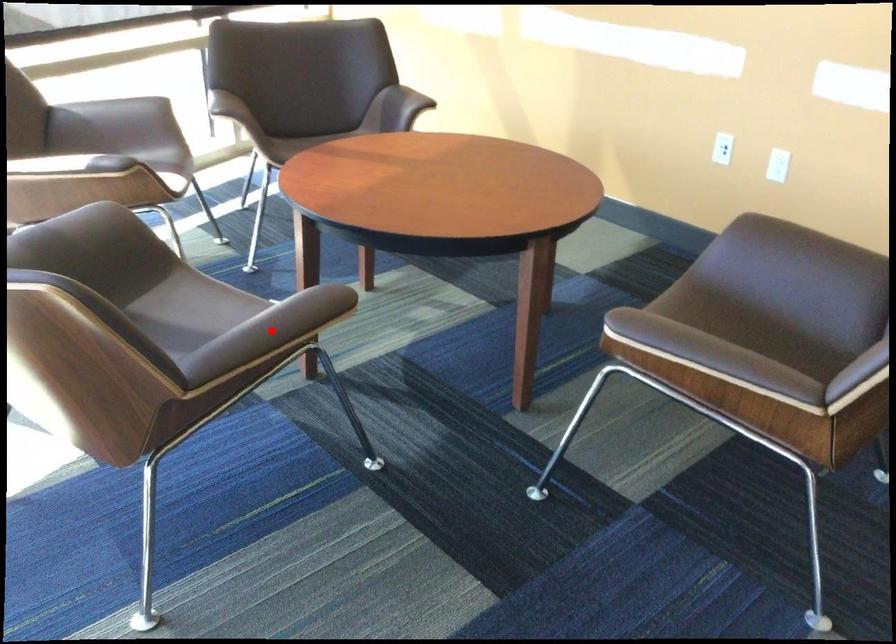
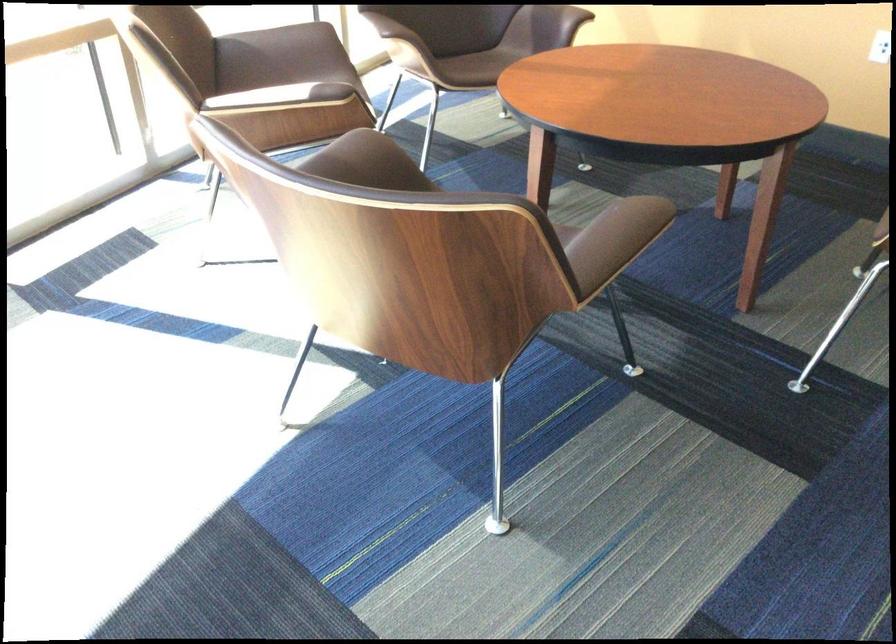
Where in the second image is the point corresponding to the highlighted location from the first image?

(614, 240)